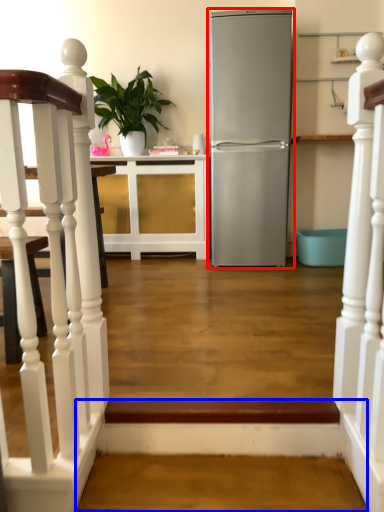
Question: Which object appears farthest to the camera in this image, refrigerator (highlighted by a red box) or stairwell (highlighted by a blue box)?

Choices:
 (A) refrigerator
 (B) stairwell

Answer: (A)